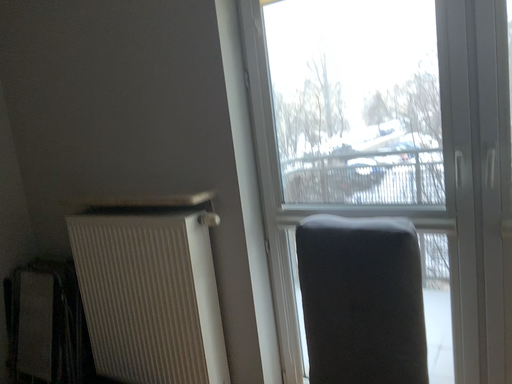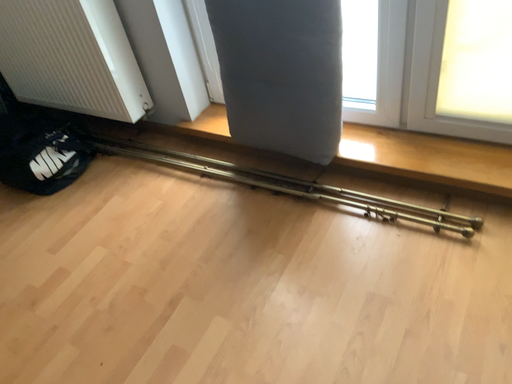
Question: Which way did the camera rotate in the video?

Choices:
 (A) rotated downward
 (B) rotated upward

Answer: (A)